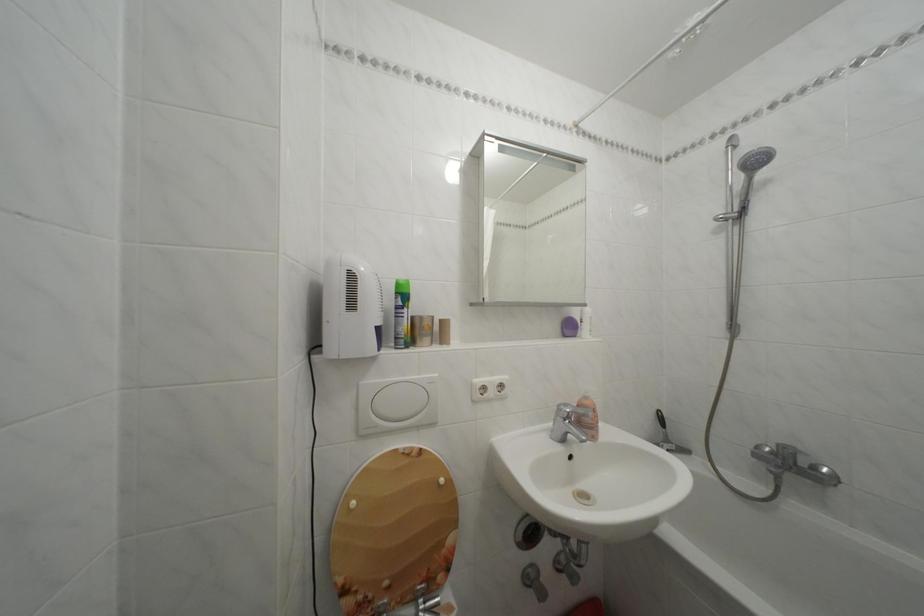
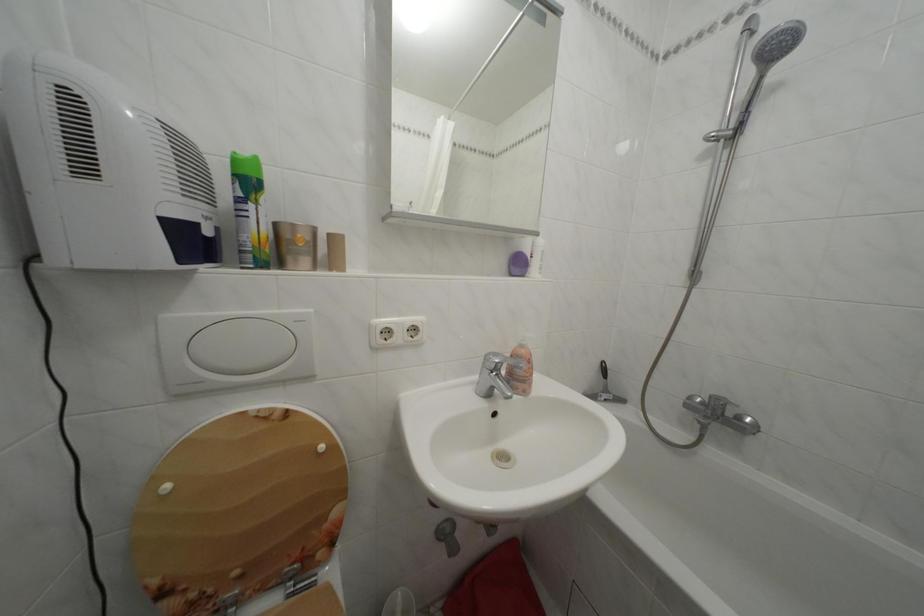
Locate, in the second image, the point that corresponds to point (578, 334) in the first image.

(527, 270)